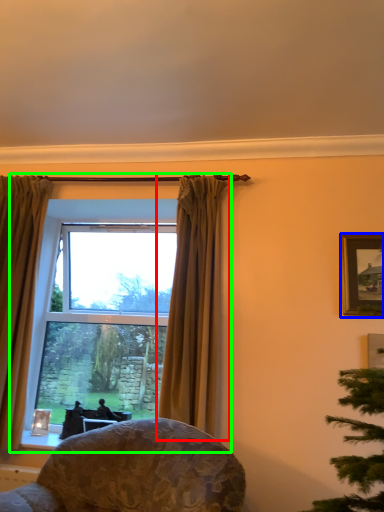
Question: Which is farther away from curtain (highlighted by a red box)? picture frame (highlighted by a blue box) or window (highlighted by a green box)?

Choices:
 (A) picture frame
 (B) window

Answer: (B)